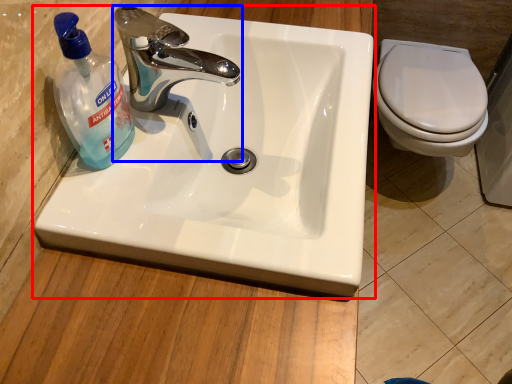
Question: Which point is further to the camera, sink (highlighted by a red box) or tap (highlighted by a blue box)?

Choices:
 (A) sink
 (B) tap

Answer: (B)